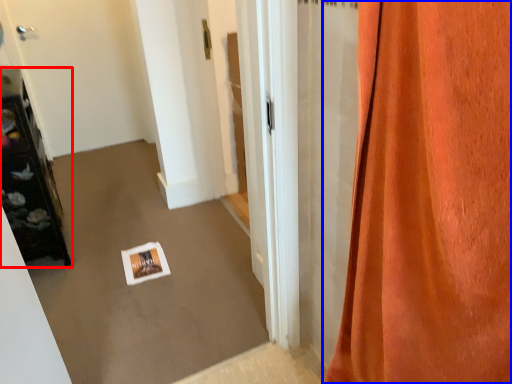
Question: Among these objects, which one is farthest to the camera, furniture (highlighted by a red box) or curtain (highlighted by a blue box)?

Choices:
 (A) furniture
 (B) curtain

Answer: (A)